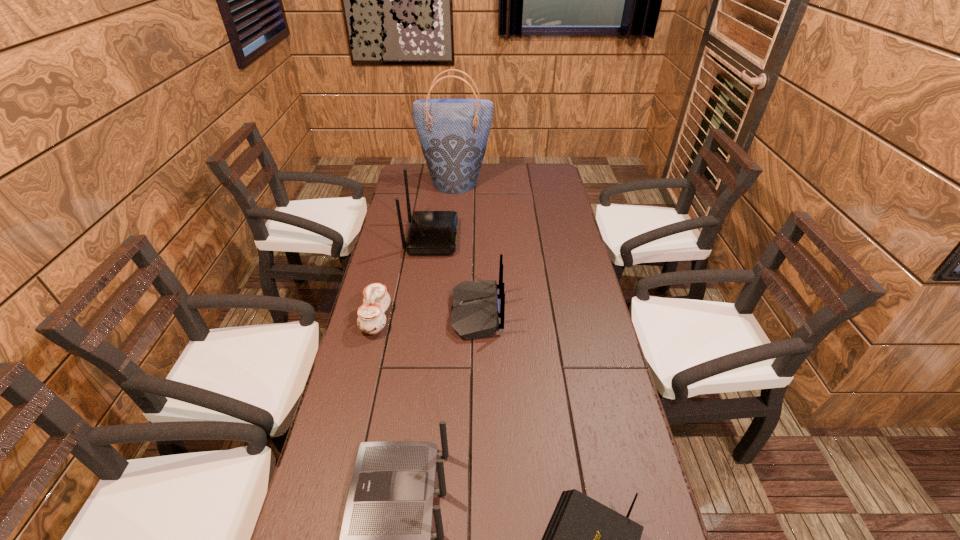
Choose which object is the fifth nearest neighbor to the farthest router. Please provide its 2D coordinates. Your answer should be formatted as a tuple, i.e. [(x, y)], where the tuple contains the x and y coordinates of a point satisfying the conditions above.

[(584, 539)]

Identify which object is the fourth closest to the third nearest router. Please provide its 2D coordinates. Your answer should be formatted as a tuple, i.e. [(x, y)], where the tuple contains the x and y coordinates of a point satisfying the conditions above.

[(584, 539)]

Identify the location of the closest router to the second farthest router. (431, 232).

Locate which router ranks in proximity to the tallest object. Please provide its 2D coordinates. Your answer should be formatted as a tuple, i.e. [(x, y)], where the tuple contains the x and y coordinates of a point satisfying the conditions above.

[(431, 232)]